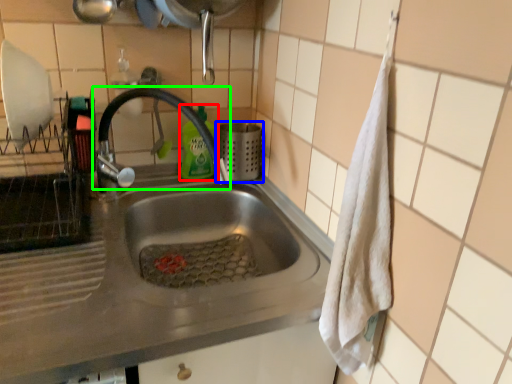
Question: Estimate the real-world distances between objects in this image. Which object is farther from cleaning product (highlighted by a red box), appliance (highlighted by a blue box) or tap (highlighted by a green box)?

Choices:
 (A) appliance
 (B) tap

Answer: (B)